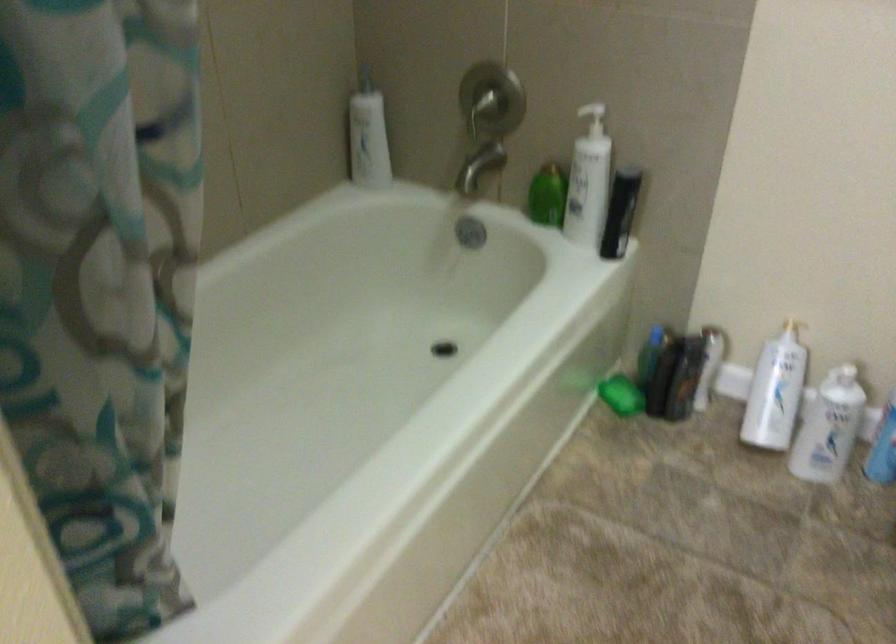
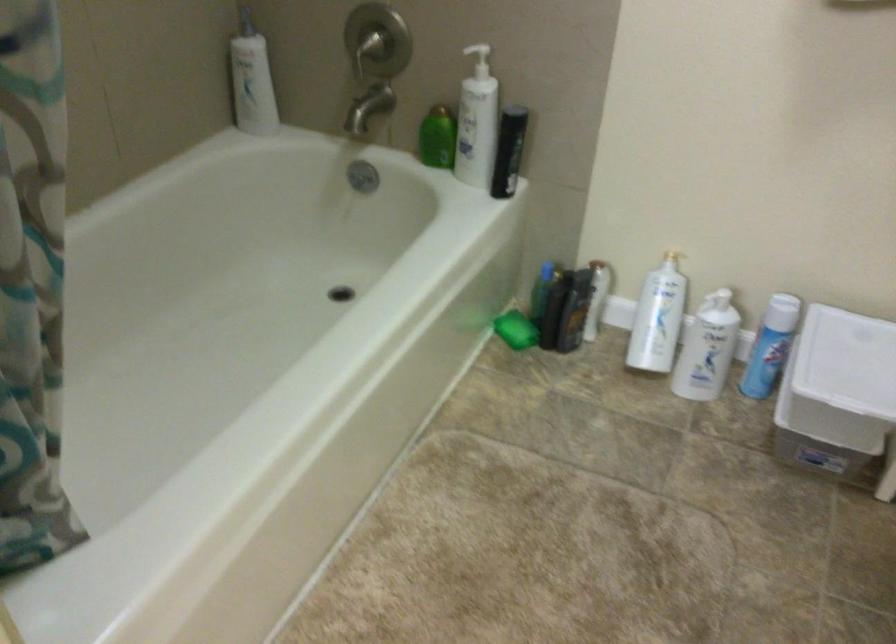
Find the pixel in the second image that matches (x=478, y=169) in the first image.

(368, 108)